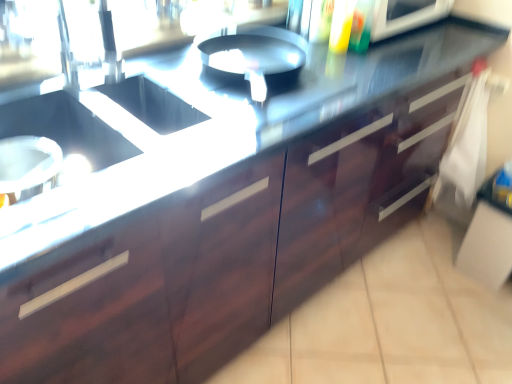
Question: Relative to translucent plastic bottle at upper center, is dark wood drawer at right in front or behind?

Choices:
 (A) front
 (B) behind

Answer: (B)

Question: From the image's perspective, is dark wood drawer at right located above or below translucent plastic bottle at upper center?

Choices:
 (A) below
 (B) above

Answer: (A)

Question: Considering the positions of dark wood drawer at right and translucent plastic bottle at upper center in the image, is dark wood drawer at right bigger or smaller than translucent plastic bottle at upper center?

Choices:
 (A) small
 (B) big

Answer: (B)

Question: From the image's perspective, is translucent plastic bottle at upper center located above or below dark wood drawer at right?

Choices:
 (A) above
 (B) below

Answer: (A)

Question: In terms of width, does translucent plastic bottle at upper center look wider or thinner when compared to dark wood drawer at right?

Choices:
 (A) thin
 (B) wide

Answer: (B)

Question: From a real-world perspective, is translucent plastic bottle at upper center physically located above or below dark wood drawer at right?

Choices:
 (A) above
 (B) below

Answer: (A)

Question: In terms of size, does translucent plastic bottle at upper center appear bigger or smaller than dark wood drawer at right?

Choices:
 (A) big
 (B) small

Answer: (B)